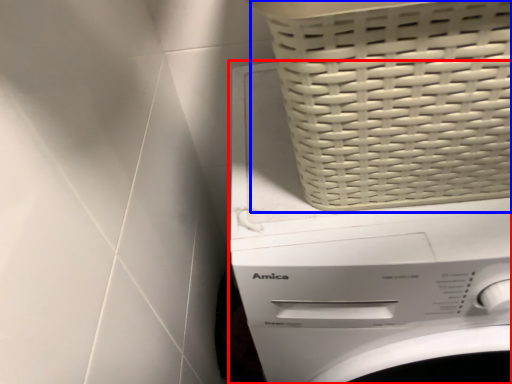
Question: Which point is closer to the camera, washing machine (highlighted by a red box) or basket (highlighted by a blue box)?

Choices:
 (A) washing machine
 (B) basket

Answer: (B)